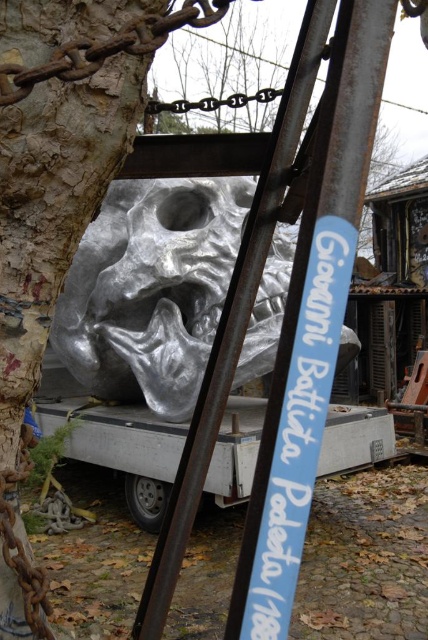
Question: Is rustic bark tree trunk at left bigger than brushed metal tree at center?

Choices:
 (A) yes
 (B) no

Answer: (B)

Question: Which object is the farthest from the rustic bark tree trunk at left?

Choices:
 (A) brushed metal tree at center
 (B) shiny silver mask at center

Answer: (A)

Question: Among these objects, which one is farthest from the camera?

Choices:
 (A) brushed metal tree at center
 (B) shiny silver mask at center
 (C) rustic bark tree trunk at left

Answer: (A)

Question: Considering the real-world distances, which object is farthest from the shiny silver mask at center?

Choices:
 (A) rustic bark tree trunk at left
 (B) brushed metal tree at center

Answer: (B)

Question: Is shiny silver mask at center below rustic bark tree trunk at left?

Choices:
 (A) no
 (B) yes

Answer: (A)

Question: Does shiny silver mask at center come in front of rustic bark tree trunk at left?

Choices:
 (A) no
 (B) yes

Answer: (A)